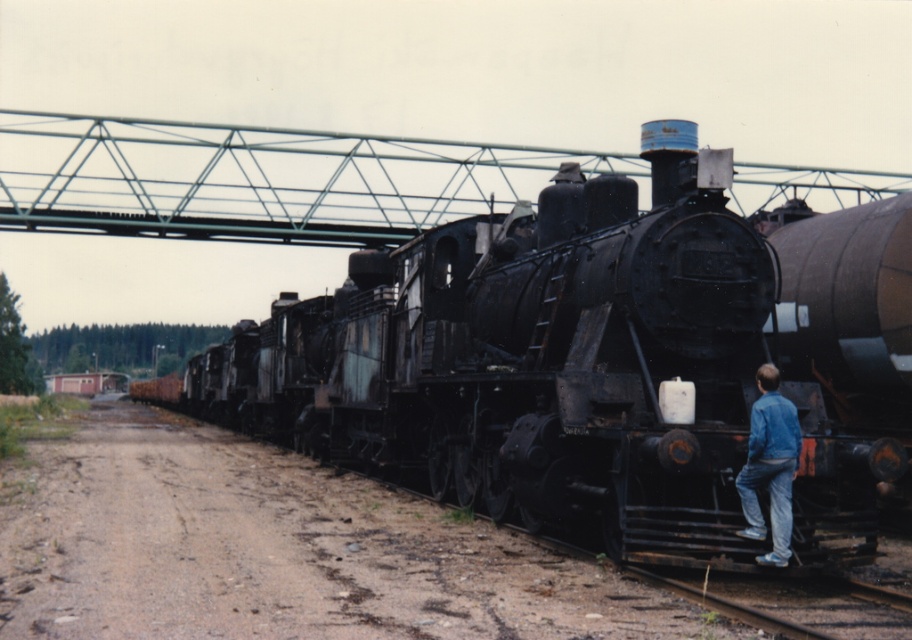
Question: Which object is farther from the camera taking this photo?

Choices:
 (A) rusty metal train at center
 (B) blue denim jacket at lower right

Answer: (A)

Question: Which of the following is the closest to the observer?

Choices:
 (A) (278, 332)
 (B) (742, 476)

Answer: (B)

Question: Does rusty metal train at center have a smaller size compared to blue denim jacket at lower right?

Choices:
 (A) no
 (B) yes

Answer: (A)

Question: Does rusty metal train at center appear under blue denim jacket at lower right?

Choices:
 (A) no
 (B) yes

Answer: (A)

Question: Is rusty metal train at center to the right of blue denim jacket at lower right from the viewer's perspective?

Choices:
 (A) no
 (B) yes

Answer: (A)